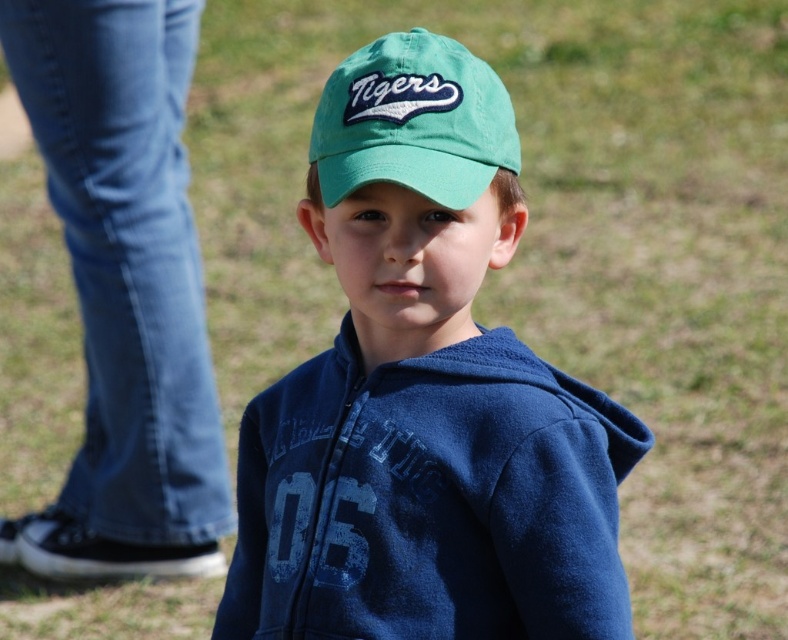
You are a photographer adjusting your camera settings to focus on two points in the image. The first point is at coordinates point (x=348, y=202) and the second point is at point (x=374, y=112). Which point should you focus on first if you want to ensure the closest object is in sharp focus?

Point (x=348, y=202) is further to the camera than point (x=374, y=112). Therefore, to focus on the closest object first, you should focus on point (x=374, y=112) first.